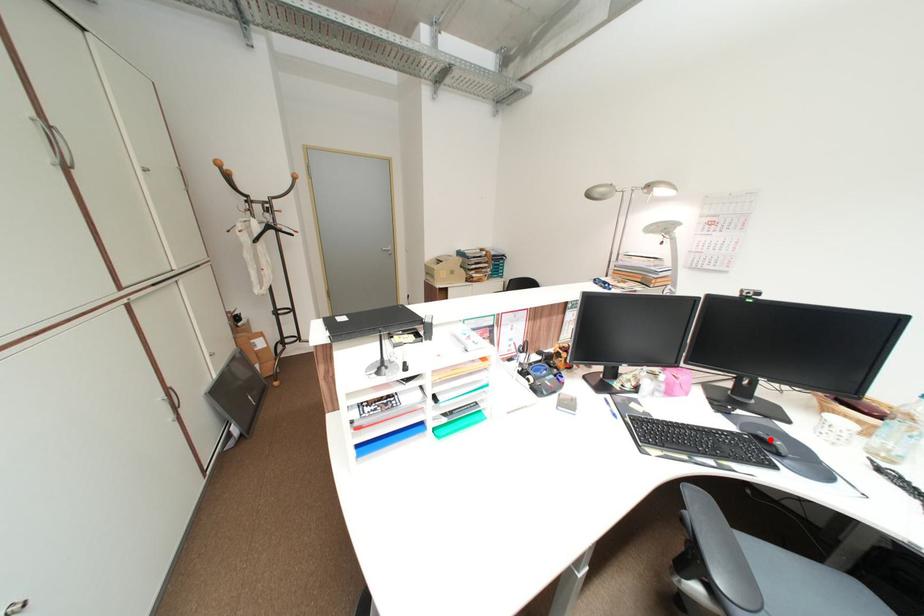
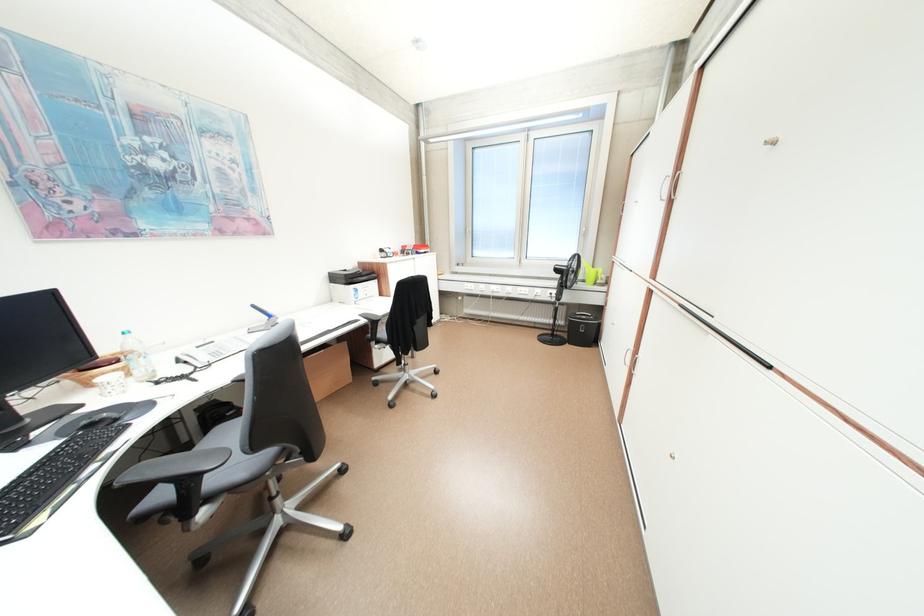
Where in the second image is the point corresponding to the highlighted location from the first image?

(101, 426)